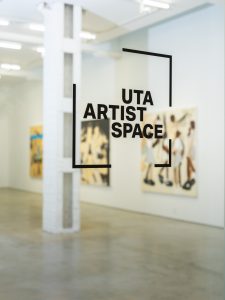
The height and width of the screenshot is (300, 225). I want to click on wall-hanging canvas paintings, so click(178, 130), click(95, 135), click(38, 137).